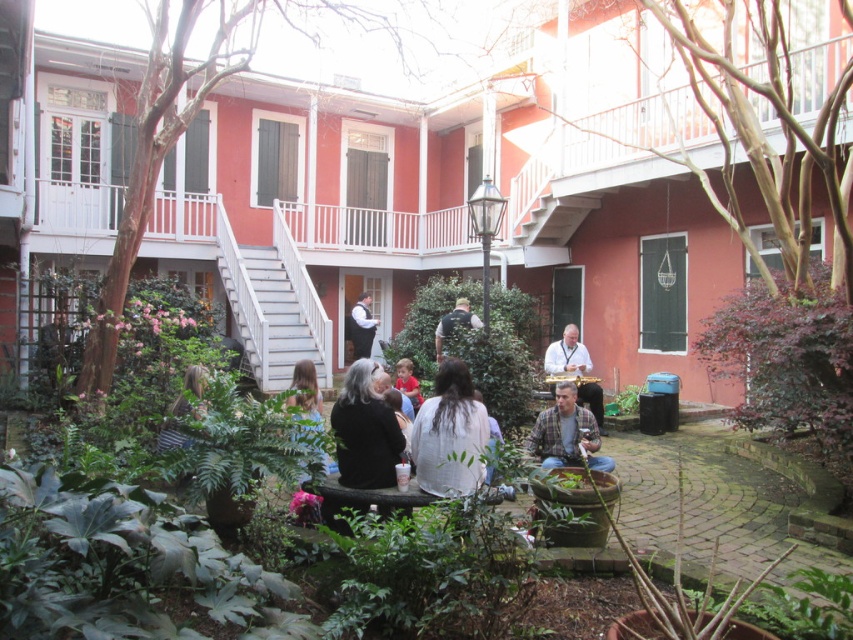
You are standing in the courtyard and want to take a photo of the blonde hair at lower center. Where should you position yourself to capture it in the frame?

The blonde hair at lower center is located at point (183,410), so you should position yourself in the lower center area of the courtyard to capture it in the frame.